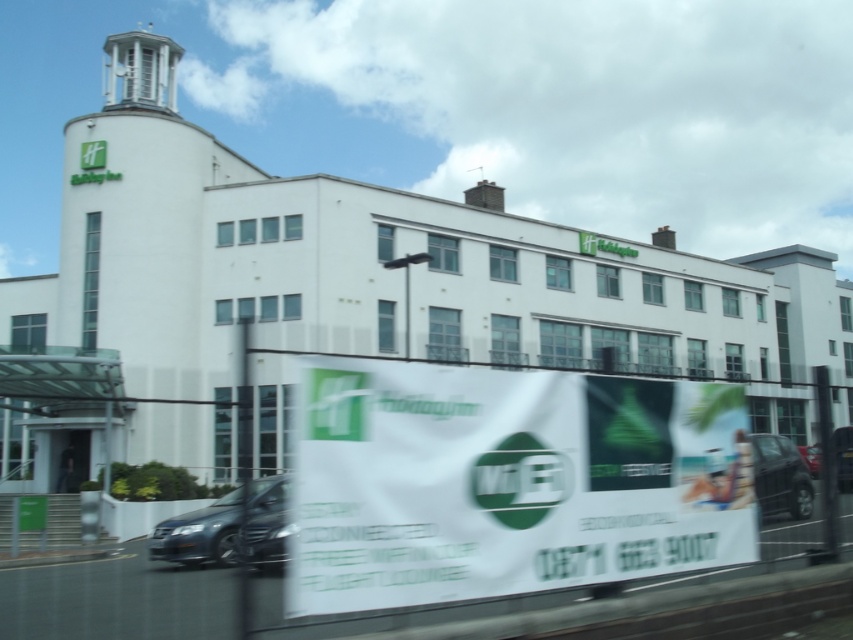
You are standing in front of the modern white building and want to take a photo of the shiny black car at lower right without the white fabric banner at center blocking the view. Is this possible?

The white fabric banner at center is closer to the viewer than the shiny black car at lower right, so the banner would block the view of the car. You would need to move to a position where the banner is not between you and the car to take an unobstructed photo.

You are a delivery driver who needs to park your vehicle in the parking lot behind the building. The parking spaces are exactly the width of the shiny black car at lower right. Can your shiny metallic car at lower left fit into these spaces?

The shiny metallic car at lower left is wider than the shiny black car at lower right. Since the parking spaces are the same width as the shiny black car at lower right, the shiny metallic car at lower left cannot fit into these spaces.

You are standing in front of the modern white building and want to take a photo of the shiny metallic car at lower left without the white fabric banner at center appearing in the shot. Is this possible?

The white fabric banner at center is to the right of the shiny metallic car at lower left, so if you position yourself to the left side of the car and aim your camera away from the banner, you can capture the car without the banner in the frame.